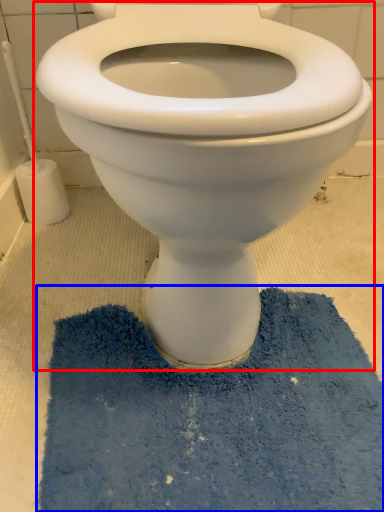
Question: Which point is closer to the camera, toilet (highlighted by a red box) or bath mat (highlighted by a blue box)?

Choices:
 (A) toilet
 (B) bath mat

Answer: (A)